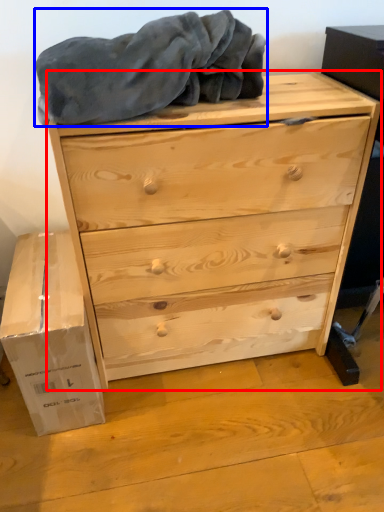
Question: Which object is closer to the camera taking this photo, chest of drawers (highlighted by a red box) or blanket (highlighted by a blue box)?

Choices:
 (A) chest of drawers
 (B) blanket

Answer: (B)